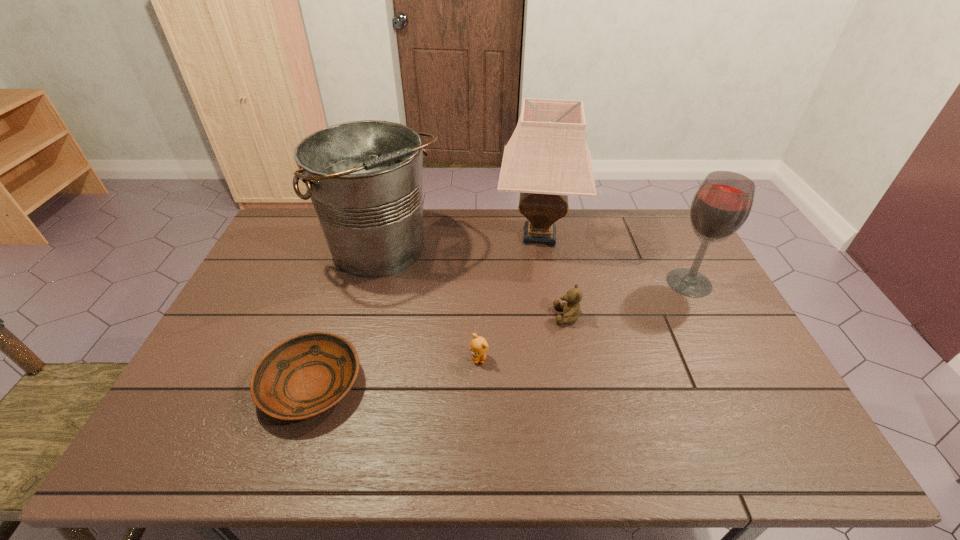
You are a GUI agent. You are given a task and a screenshot of the screen. Output one action in this format:
    pyautogui.click(x=<x>, y=<y>)
    Task: Click on the free location at the far edge
    The height and width of the screenshot is (540, 960).
    Given the screenshot: What is the action you would take?
    pyautogui.click(x=619, y=238)

The image size is (960, 540). Find the location of `vacant space at the near edge of the desktop`. vacant space at the near edge of the desktop is located at coordinates (x=519, y=428).

Where is `vacant space at the left edge of the desktop`? vacant space at the left edge of the desktop is located at coordinates (267, 320).

Where is `vacant space at the right edge of the desktop`? vacant space at the right edge of the desktop is located at coordinates coord(706,308).

Identify the location of empty space between the alcohol and the lampshade. (614, 259).

Image resolution: width=960 pixels, height=540 pixels. I want to click on unoccupied area between the lampshade and the alcohol, so click(614, 259).

The width and height of the screenshot is (960, 540). In order to click on free space between the taller teddy bear and the lampshade in this screenshot , I will do `click(554, 276)`.

I want to click on free spot between the bucket and the lampshade, so [x=462, y=244].

What are the coordinates of `vacant space that's between the shorter teddy bear and the alcohol` in the screenshot? It's located at (584, 320).

What are the coordinates of `free space between the bucket and the rightmost object` in the screenshot? It's located at (537, 267).